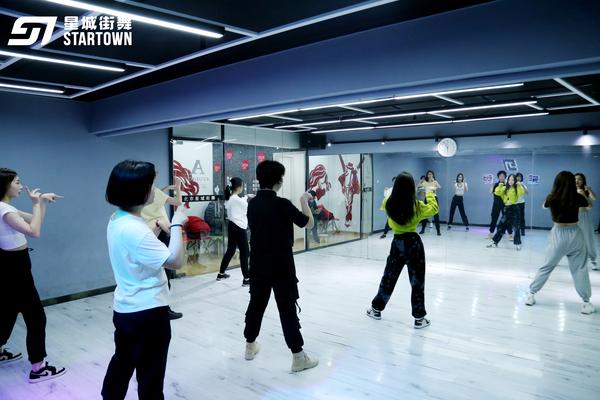
Locate an element on the screen. clock is located at coordinates (446, 146).